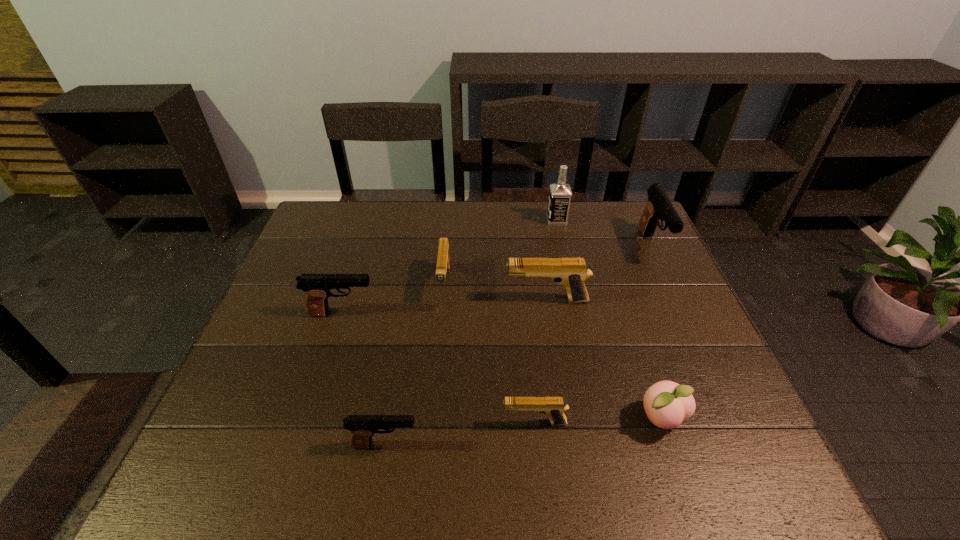
This screenshot has height=540, width=960. I want to click on free space between the pink peach and the third pistol from left to right, so click(553, 351).

Find the location of a particular element. vacant area between the nearest pistol and the shortest object is located at coordinates (460, 434).

Image resolution: width=960 pixels, height=540 pixels. Find the location of `free point between the fifth farthest pistol and the leftmost black pistol`. free point between the fifth farthest pistol and the leftmost black pistol is located at coordinates (439, 368).

Where is `blank region between the rightmost object and the fifth farthest pistol`? This screenshot has height=540, width=960. blank region between the rightmost object and the fifth farthest pistol is located at coordinates (593, 335).

The width and height of the screenshot is (960, 540). What are the coordinates of `vacant point located between the shortest object and the biggest tan pistol` in the screenshot? It's located at (540, 362).

Where is `blank region between the biggest tan pistol and the second object from right to left`? blank region between the biggest tan pistol and the second object from right to left is located at coordinates click(x=604, y=360).

You are a GUI agent. You are given a task and a screenshot of the screen. Output one action in this format:
    pyautogui.click(x=<x>, y=<y>)
    Task: Click on the free spot between the nearest tan pistol and the fifth farthest object
    Image resolution: width=960 pixels, height=540 pixels.
    Given the screenshot: What is the action you would take?
    pyautogui.click(x=439, y=368)

Find the location of a particular element. free spot between the peach and the leftmost object is located at coordinates (502, 367).

This screenshot has width=960, height=540. Find the location of `unoccupied area between the biggest tan pistol and the fourth nearest object`. unoccupied area between the biggest tan pistol and the fourth nearest object is located at coordinates (444, 307).

Identify the location of free spot between the peach and the shortest pistol. This screenshot has height=540, width=960. (598, 421).